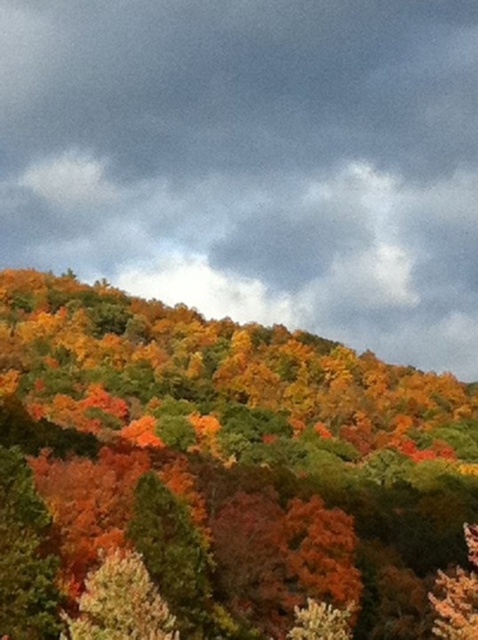
Can you confirm if cloudy gray sky at upper center is positioned to the right of multicolored foliage at center?

Correct, you'll find cloudy gray sky at upper center to the right of multicolored foliage at center.

Describe the element at coordinates (253, 161) in the screenshot. I see `cloudy gray sky at upper center` at that location.

Where is `cloudy gray sky at upper center`? The width and height of the screenshot is (478, 640). cloudy gray sky at upper center is located at coordinates (253, 161).

Image resolution: width=478 pixels, height=640 pixels. Identify the location of cloudy gray sky at upper center. 253,161.